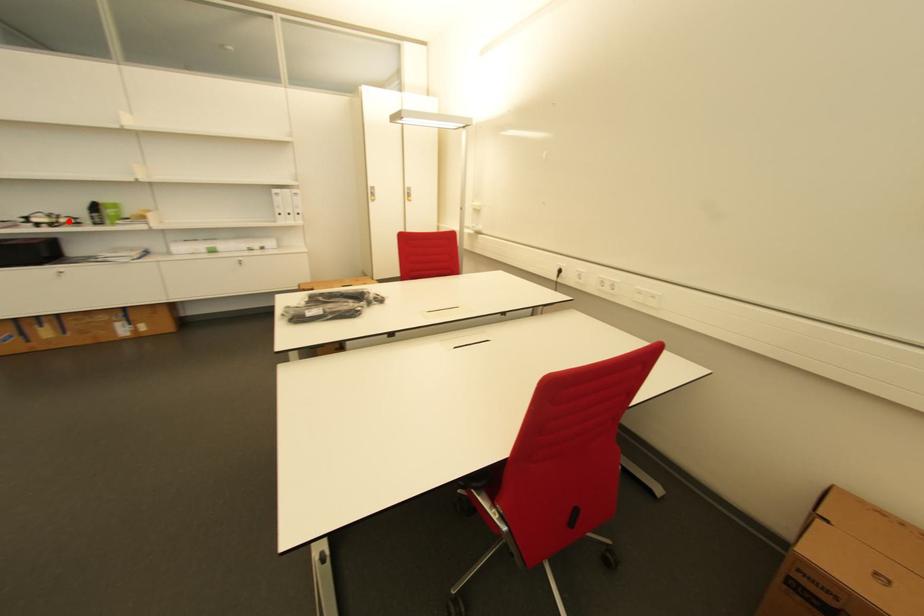
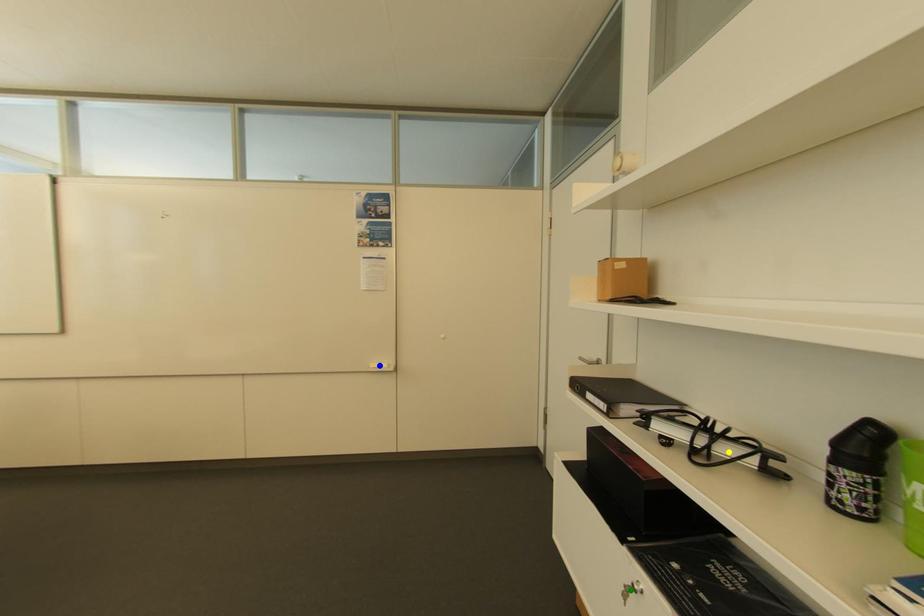
Question: I am providing you with two images of the same scene from different viewpoints. A red point is marked on the first image. You are given multiple points on the second image. Which point in image 2 is actually the same real-world point as the red point in image 1?

Choices:
 (A) yellow point
 (B) green point
 (C) blue point

Answer: (A)